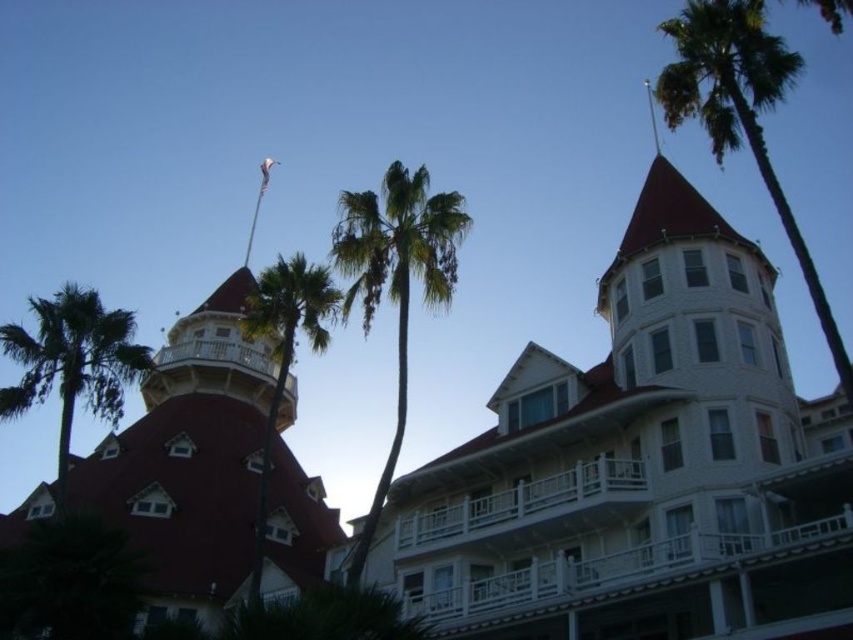
You are standing in front of the grand building and want to take a photo that includes both the green leafy palm tree at upper right and the green leafy palm tree at center. Which palm tree should you position closer to the front of your photo frame?

To include both the green leafy palm tree at upper right and the green leafy palm tree at center in your photo, you should position the green leafy palm tree at upper right closer to the front of your photo frame since it is closer to the viewer than the green leafy palm tree at center.

From the picture: You are standing in front of the grand building and want to walk from the green leafy palm tree at upper right to the green leafy palm tree at center. How far will you have to walk?

The green leafy palm tree at upper right is 121.80 feet away from the green leafy palm tree at center, so you will have to walk 121.80 feet.

You are standing in front of the grand building with palm trees. You want to take a photo of the point at coordinates point (248, 426). If your camera has a maximum focus range of 100 meters, will it be able to focus on that point?

The point (248, 426) is 94.43 meters from the camera. Since this distance is within the camera maximum focus range of 100 meters, the camera can focus on the point (248, 426).